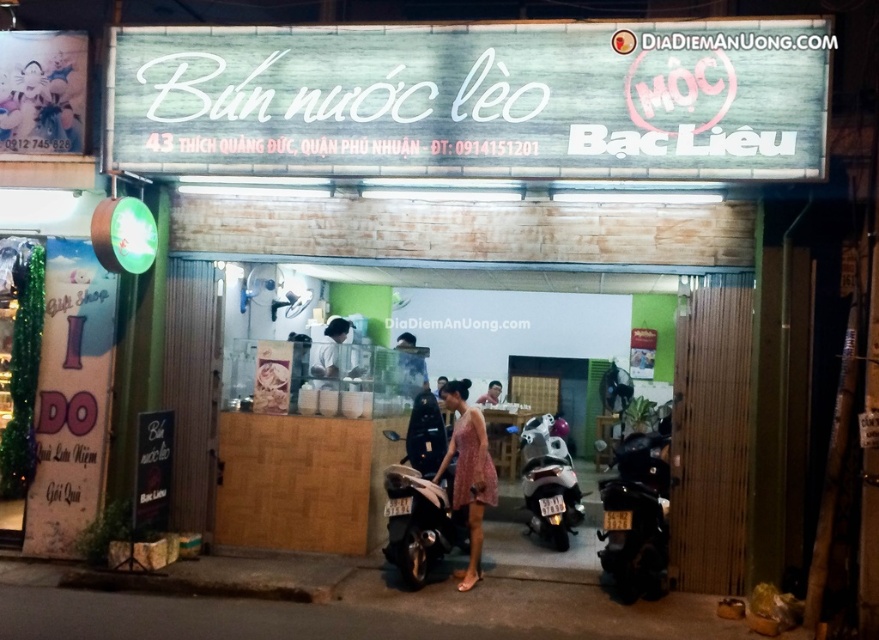
I want to click on white wood sign at upper center, so click(474, 99).

Who is positioned more to the left, white wood sign at upper center or black matte motorcycle at lower right?

Positioned to the left is black matte motorcycle at lower right.

This screenshot has height=640, width=879. What do you see at coordinates (474, 99) in the screenshot? I see `white wood sign at upper center` at bounding box center [474, 99].

Where is `white wood sign at upper center`? The height and width of the screenshot is (640, 879). white wood sign at upper center is located at coordinates (474, 99).

This screenshot has height=640, width=879. In order to click on white wood sign at upper center in this screenshot , I will do `click(474, 99)`.

Locate an element on the screen. white wood sign at upper center is located at coordinates (474, 99).

Can you confirm if black matte motorcycle at center is positioned below white glossy cup at center?

Yes, black matte motorcycle at center is below white glossy cup at center.

Is black matte motorcycle at center shorter than white glossy cup at center?

In fact, black matte motorcycle at center may be taller than white glossy cup at center.

I want to click on black matte motorcycle at center, so click(420, 515).

This screenshot has width=879, height=640. In order to click on black matte motorcycle at center in this screenshot , I will do `click(420, 515)`.